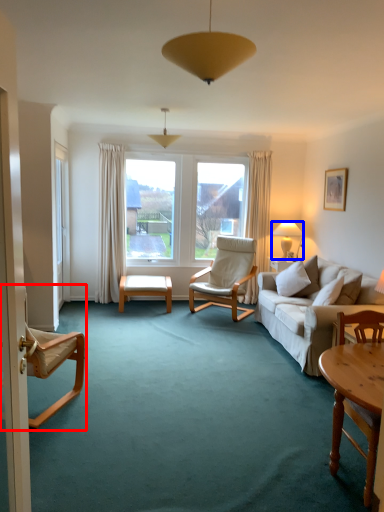
Question: Which object is closer to the camera taking this photo, chair (highlighted by a red box) or lamp (highlighted by a blue box)?

Choices:
 (A) chair
 (B) lamp

Answer: (A)